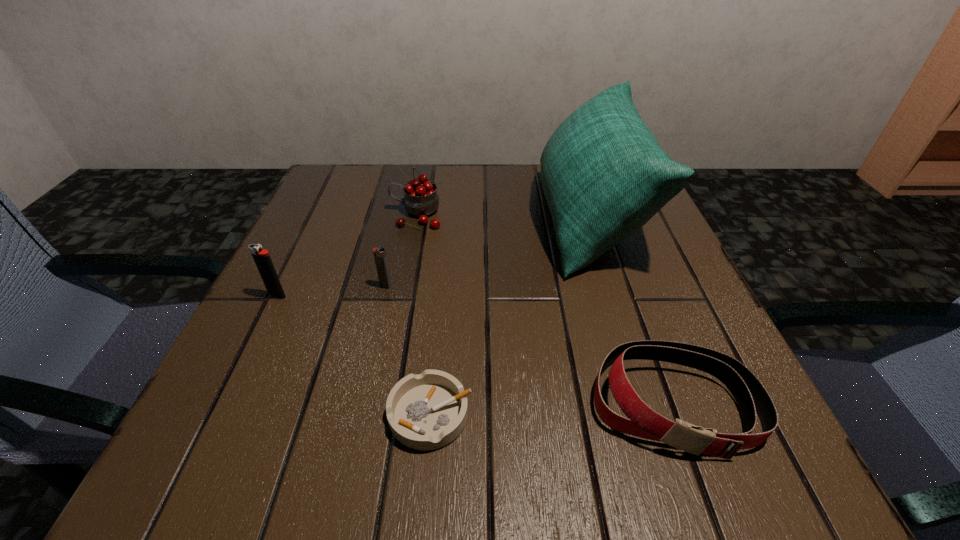
The image size is (960, 540). Find the location of `cushion`. cushion is located at coordinates (604, 175).

The width and height of the screenshot is (960, 540). Find the location of `cherry`. cherry is located at coordinates (421, 199).

You are a GUI agent. You are given a task and a screenshot of the screen. Output one action in this format:
    pyautogui.click(x=<x>, y=<y>)
    Task: Click on the left igniter
    The width and height of the screenshot is (960, 540).
    Given the screenshot: What is the action you would take?
    pyautogui.click(x=262, y=259)

Locate an element on the screen. This screenshot has height=540, width=960. the taller igniter is located at coordinates (262, 259).

Locate an element on the screen. the right igniter is located at coordinates (380, 256).

The image size is (960, 540). I want to click on the shorter igniter, so click(380, 256).

You are a GUI agent. You are given a task and a screenshot of the screen. Output one action in this format:
    pyautogui.click(x=<x>, y=<y>)
    Task: Click on the second shortest object
    Image resolution: width=960 pixels, height=540 pixels.
    Given the screenshot: What is the action you would take?
    pyautogui.click(x=750, y=395)

This screenshot has height=540, width=960. Find the location of `the shortest object`. the shortest object is located at coordinates (427, 411).

I want to click on vacant region located 0.240m on the front-facing side of the cushion, so click(428, 218).

Where is `free spot located on the front-facing side of the cushion`? The height and width of the screenshot is (540, 960). free spot located on the front-facing side of the cushion is located at coordinates (354, 218).